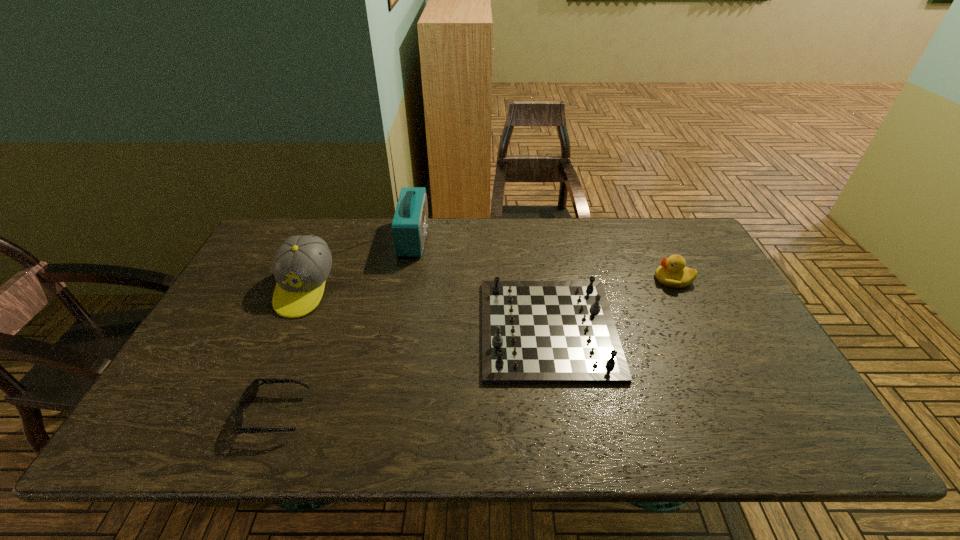
At what (x,y) coordinates should I click in order to perform the action: click on free space between the rightmost object and the tallest object. Please return your answer as a coordinate pair (x, y). This screenshot has height=540, width=960. Looking at the image, I should click on (543, 258).

At what (x,y) coordinates should I click in order to perform the action: click on vacant space that's between the sunglasses and the third tallest object. Please return your answer as a coordinate pair (x, y). Looking at the image, I should click on (474, 346).

The image size is (960, 540). I want to click on unoccupied area between the second shortest object and the duckling, so click(x=611, y=304).

Locate an element on the screen. This screenshot has width=960, height=540. free point between the third shortest object and the tallest object is located at coordinates (543, 258).

The width and height of the screenshot is (960, 540). Find the location of `free space between the nearest object and the duckling`. free space between the nearest object and the duckling is located at coordinates (474, 346).

In order to click on empty space between the sunglasses and the third object from left to right in this screenshot , I will do `click(345, 325)`.

Where is `free space between the third tallest object and the radio receiver`? This screenshot has height=540, width=960. free space between the third tallest object and the radio receiver is located at coordinates (543, 258).

Locate which object is the second closest to the third tallest object. Please provide its 2D coordinates. Your answer should be formatted as a tuple, i.e. [(x, y)], where the tuple contains the x and y coordinates of a point satisfying the conditions above.

[(410, 222)]

Point out which object is positioned as the nearest to the duckling. Please provide its 2D coordinates. Your answer should be formatted as a tuple, i.e. [(x, y)], where the tuple contains the x and y coordinates of a point satisfying the conditions above.

[(533, 332)]

Find the location of a particular element. The height and width of the screenshot is (540, 960). free spot that satisfies the following two spatial constraints: 1. on the front panel of the farthest object; 2. on the front-facing side of the fourth shortest object is located at coordinates (404, 288).